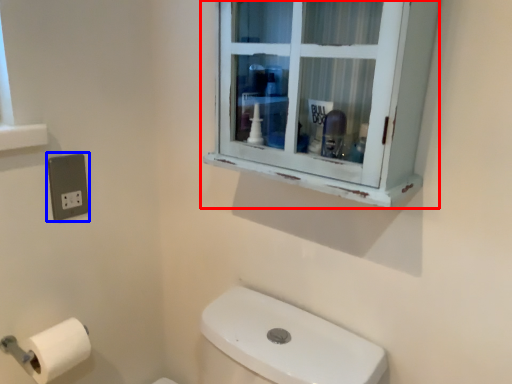
Question: Which point is further to the camera, window (highlighted by a red box) or electric outlet (highlighted by a blue box)?

Choices:
 (A) window
 (B) electric outlet

Answer: (B)